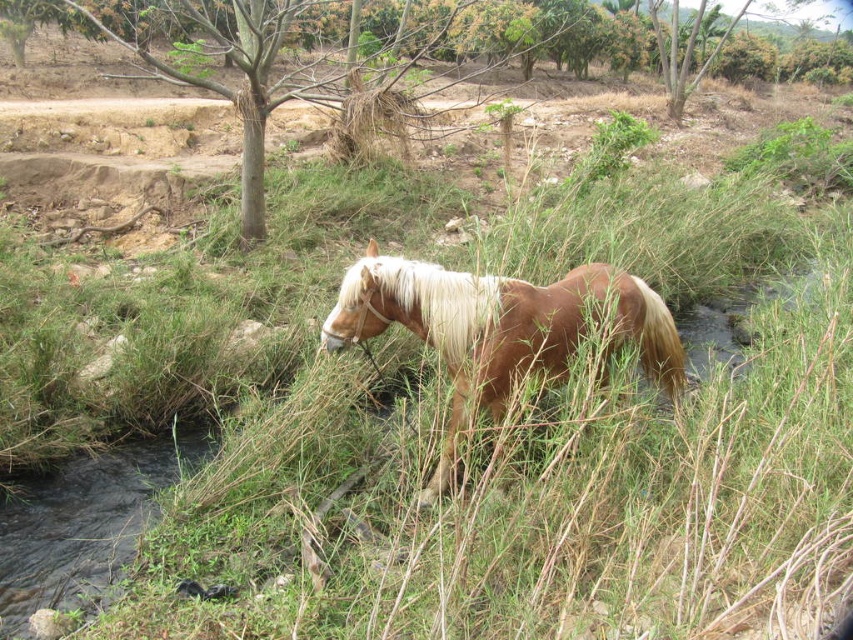
Question: Which object is closer to the camera taking this photo?

Choices:
 (A) white silky mane at center
 (B) brown glossy horse at center

Answer: (B)

Question: Is brown glossy horse at center bigger than white silky mane at center?

Choices:
 (A) yes
 (B) no

Answer: (A)

Question: Where is brown glossy horse at center located in relation to white silky mane at center in the image?

Choices:
 (A) below
 (B) above

Answer: (A)

Question: Which point is farther from the camera taking this photo?

Choices:
 (A) (383, 291)
 (B) (566, 300)

Answer: (B)

Question: Can you confirm if brown glossy horse at center is positioned to the left of white silky mane at center?

Choices:
 (A) yes
 (B) no

Answer: (B)